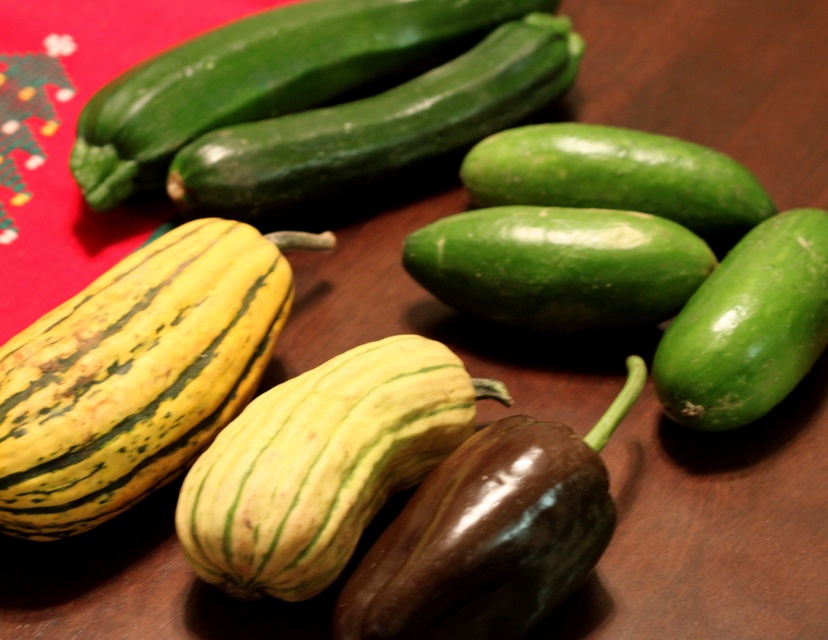
Question: Does green matte squash at center have a greater width compared to green glossy cucumber at center?

Choices:
 (A) yes
 (B) no

Answer: (B)

Question: Which point is farther to the camera?

Choices:
 (A) yellow-green striped squash at left
 (B) green glossy cucumber at center
 (C) green matte squash at center

Answer: (B)

Question: Which point is closer to the camera?

Choices:
 (A) green smooth cucumber at center
 (B) green smooth cucumber at upper center
 (C) green matte squash at center
 (D) green glossy cucumber at center

Answer: (C)

Question: Which is farther from the green glossy cucumber at center?

Choices:
 (A) green matte squash at center
 (B) shiny dark purple eggplant at center

Answer: (B)

Question: Does yellow-green striped squash at left have a larger size compared to green smooth cucumber at center right?

Choices:
 (A) yes
 (B) no

Answer: (A)

Question: Is shiny dark purple eggplant at center wider than green smooth cucumber at center right?

Choices:
 (A) yes
 (B) no

Answer: (A)